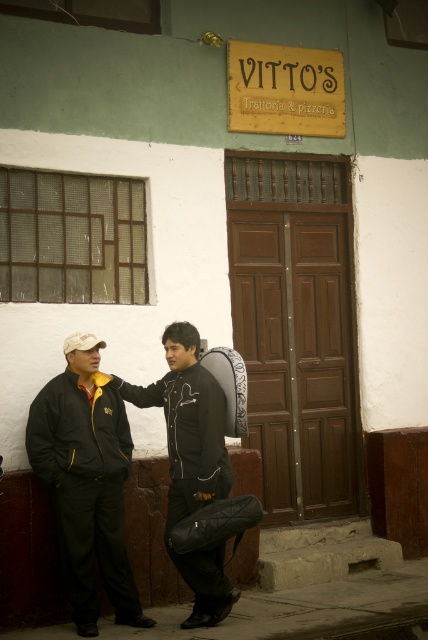
You are a photographer trying to capture both the matte black jacket at left and the black leather jacket at center in a single shot. Since you want to ensure both are in focus, which jacket should you focus on first based on their positions?

The matte black jacket at left is in front of the black leather jacket at center, so you should focus on the matte black jacket at left first to ensure both are in focus.

You are a fashion designer observing two jackets in an image. The jackets are the matte black jacket at left and the black leather jacket at center. Which of these jackets appears narrower?

The matte black jacket at left appears narrower than the black leather jacket at center as it has a lesser width.

You are a photographer trying to capture a photo of both the black leather jacket at center and the black leather backpack at center. Since they are both at center, which one should you focus on first to ensure both are in frame?

The black leather jacket at center is positioned on the left side of the black leather backpack at center, so focusing on the jacket first and then the backpack while maintaining their central position will keep both in frame.